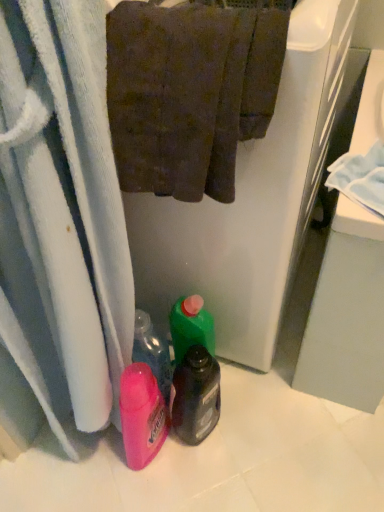
Question: Which is correct: translucent plastic bottle at center is inside brown textured towel at upper center, or outside of it?

Choices:
 (A) outside
 (B) inside

Answer: (A)

Question: Based on their sizes in the image, would you say translucent plastic bottle at center is bigger or smaller than brown textured towel at upper center?

Choices:
 (A) small
 (B) big

Answer: (A)

Question: Is translucent plastic bottle at center in front of or behind brown textured towel at upper center in the image?

Choices:
 (A) front
 (B) behind

Answer: (B)

Question: In terms of size, does brown textured towel at upper center appear bigger or smaller than translucent plastic bottle at center?

Choices:
 (A) small
 (B) big

Answer: (B)

Question: Is point (150, 13) positioned closer to the camera than point (178, 423)?

Choices:
 (A) closer
 (B) farther

Answer: (A)

Question: From the image's perspective, relative to translucent plastic bottle at center, is brown textured towel at upper center above or below?

Choices:
 (A) below
 (B) above

Answer: (B)

Question: In terms of width, does brown textured towel at upper center look wider or thinner when compared to translucent plastic bottle at center?

Choices:
 (A) thin
 (B) wide

Answer: (B)